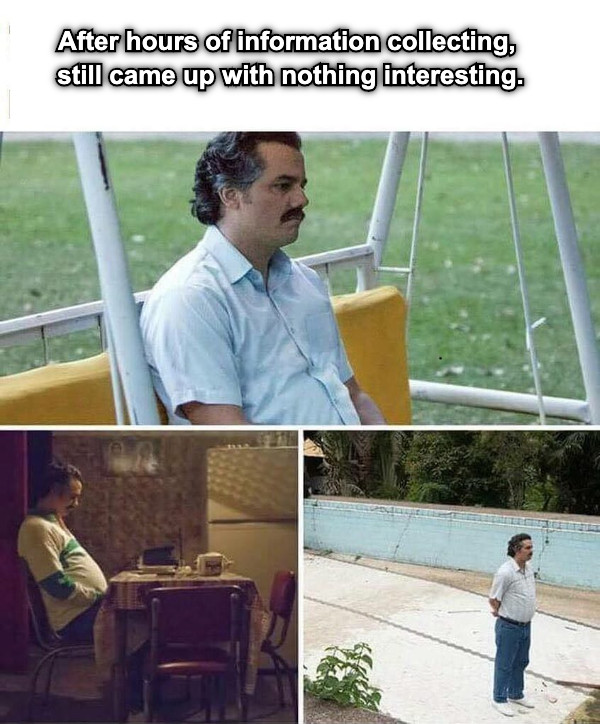
I want to click on freezer, so click(261, 489).